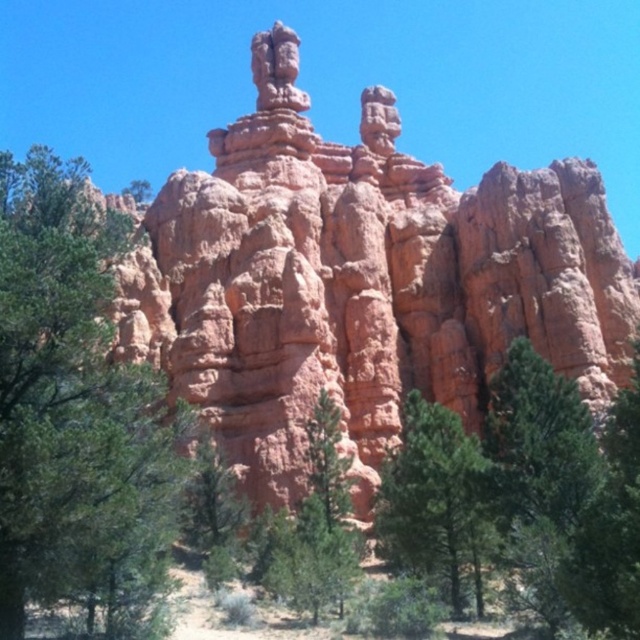
You are standing at the base of the towering red rock formation and see the point marked at coordinates (74, 404). What object is located at that point?

The point at coordinates (74, 404) indicates a green matte tree at left.